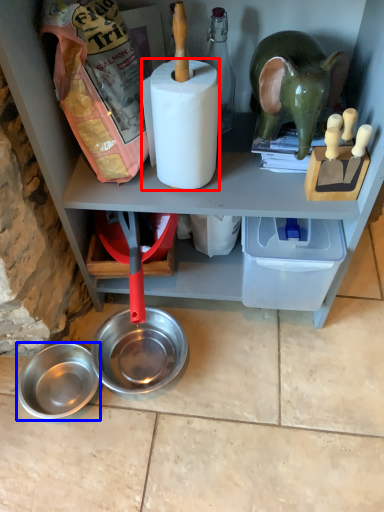
Question: Which object appears farthest to the camera in this image, paper towel (highlighted by a red box) or bowl (highlighted by a blue box)?

Choices:
 (A) paper towel
 (B) bowl

Answer: (B)